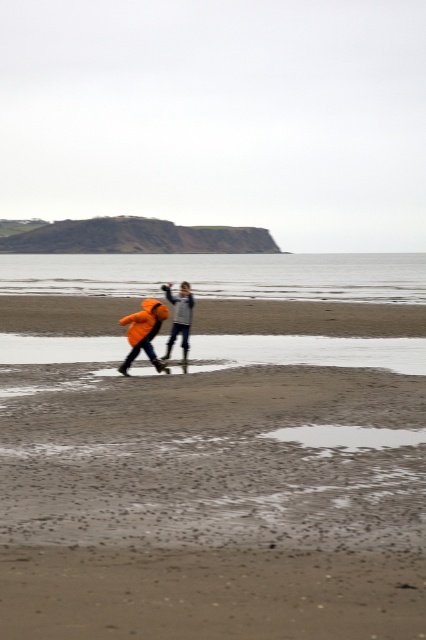
Question: Is sandy beach at center positioned before orange waterproof jacket at center?

Choices:
 (A) no
 (B) yes

Answer: (B)

Question: Considering the relative positions of sandy beach at center and orange fabric jacket at center in the image provided, where is sandy beach at center located with respect to orange fabric jacket at center?

Choices:
 (A) left
 (B) right

Answer: (B)

Question: Is sandy beach at center wider than orange fabric jacket at center?

Choices:
 (A) yes
 (B) no

Answer: (A)

Question: Among these objects, which one is nearest to the camera?

Choices:
 (A) orange fabric jacket at center
 (B) sandy beach at center
 (C) orange waterproof jacket at center

Answer: (B)

Question: Which is farther from the orange fabric jacket at center?

Choices:
 (A) sandy beach at center
 (B) orange waterproof jacket at center

Answer: (A)

Question: Which point is farther to the camera?

Choices:
 (A) (250, 401)
 (B) (146, 304)

Answer: (B)